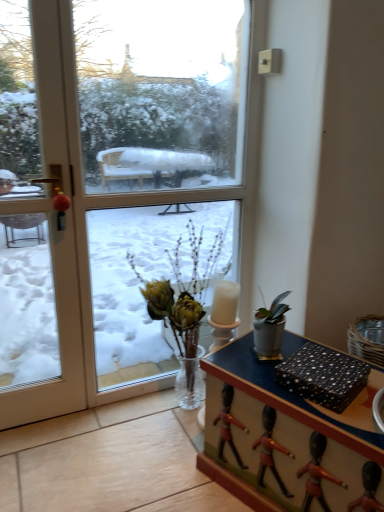
This screenshot has height=512, width=384. Identify the location of free region on the left part of black dotted paper at lower right. (257, 374).